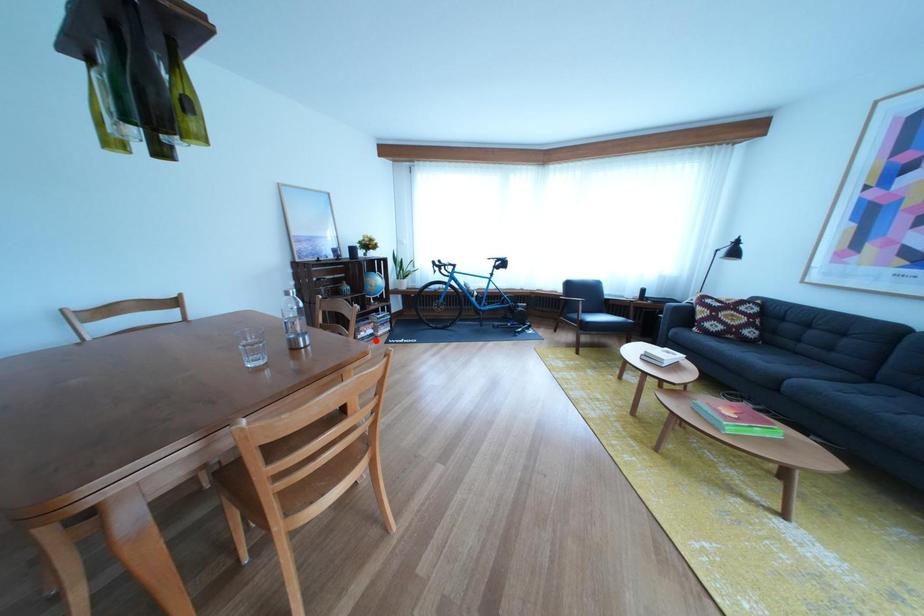
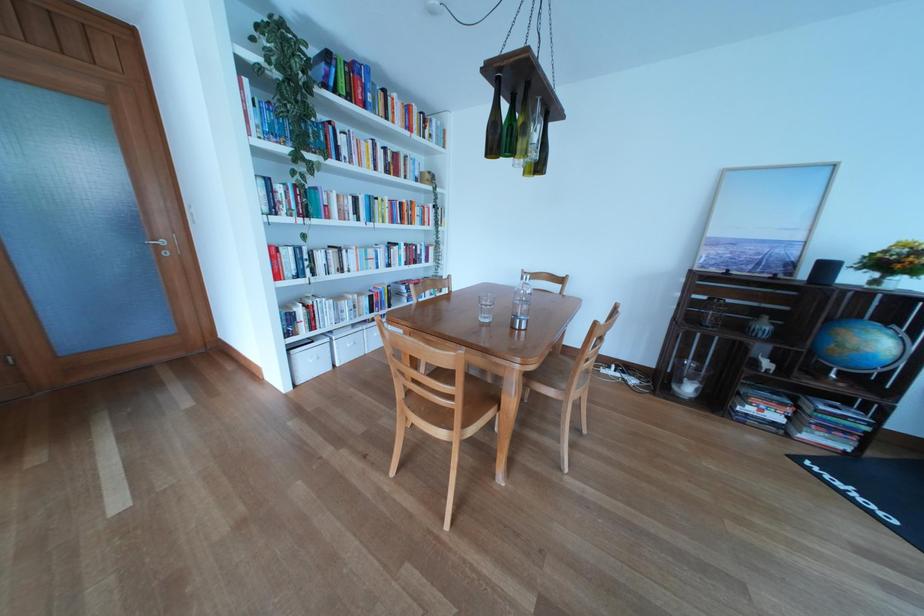
Question: I am providing you with two images of the same scene from different viewpoints. Image1 has a red point marked. In image2, the corresponding 3D location appears at what relative position? Reply with the corresponding letter.

Choices:
 (A) Closer
 (B) Farther

Answer: (B)